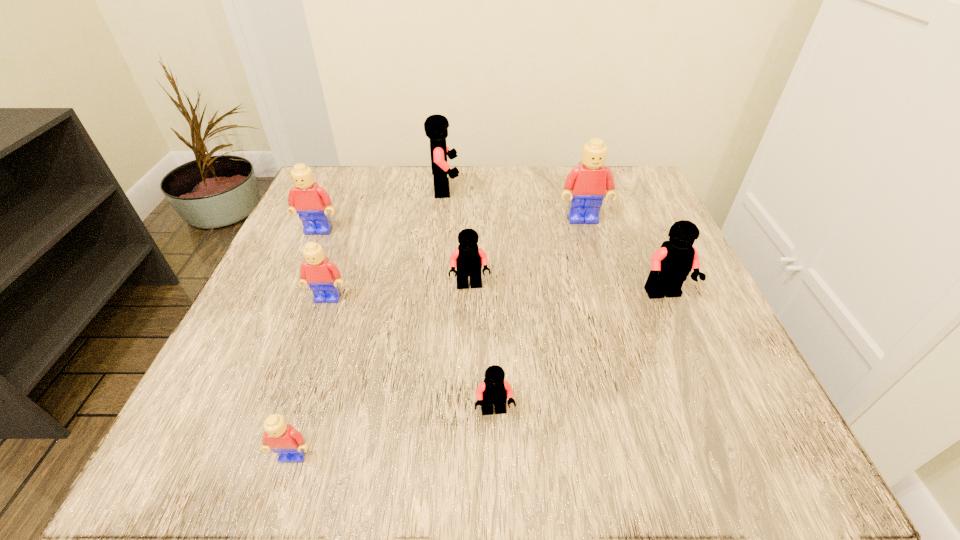
Where is `the farthest object`? This screenshot has height=540, width=960. the farthest object is located at coordinates (436, 126).

I want to click on the farthest black Lego, so click(x=436, y=126).

Find the location of a particular element. the seventh Lego from left to right is located at coordinates (587, 184).

The height and width of the screenshot is (540, 960). I want to click on the rightmost yellow Lego, so click(x=587, y=184).

This screenshot has width=960, height=540. Identify the location of the second biggest yellow Lego. (309, 200).

The height and width of the screenshot is (540, 960). What are the coordinates of `the rightmost Lego` in the screenshot? It's located at (671, 264).

You are a GUI agent. You are given a task and a screenshot of the screen. Output one action in this format:
    pyautogui.click(x=<x>, y=<y>)
    Task: Click on the rightmost black Lego
    
    Given the screenshot: What is the action you would take?
    pyautogui.click(x=671, y=264)

I want to click on the second smallest black Lego, so click(x=468, y=259).

The image size is (960, 540). I want to click on the second nearest yellow Lego, so click(322, 276).

Locate an element on the screen. the second nearest object is located at coordinates (494, 390).